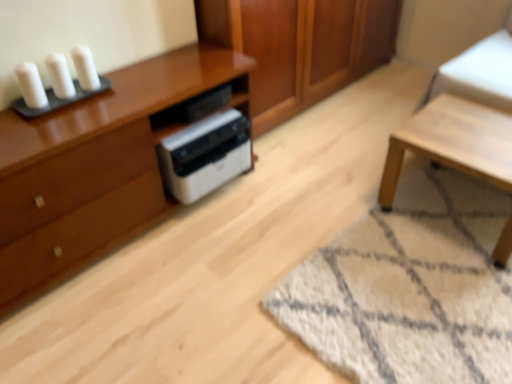
Identify the location of vacant space to the right of matte brown cabinet at left. (274, 203).